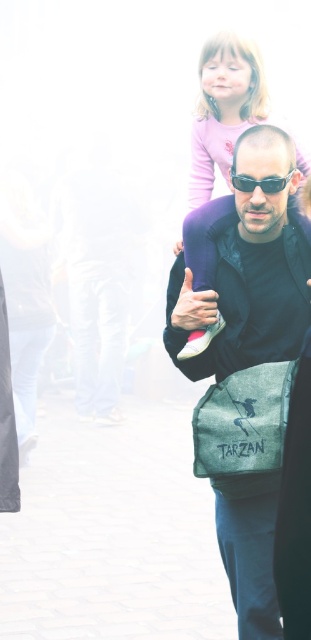
You are a photographer trying to capture the man and girl in the scene. You notice the textured gray bag at center and sunglasses at center. Which object should you focus on if you want to capture the larger one in your shot?

The textured gray bag at center is bigger than the sunglasses at center, so you should focus on the textured gray bag at center to capture the larger object in your shot.

You are a photographer trying to capture the textured gray bag at center clearly. However, the pink fabric dress at upper center is blocking your view. Can you move the bag or the dress to get a clear shot?

The textured gray bag at center is behind the pink fabric dress at upper center, so you cannot move either object. However, you can adjust your camera angle to capture the bag without obstruction.